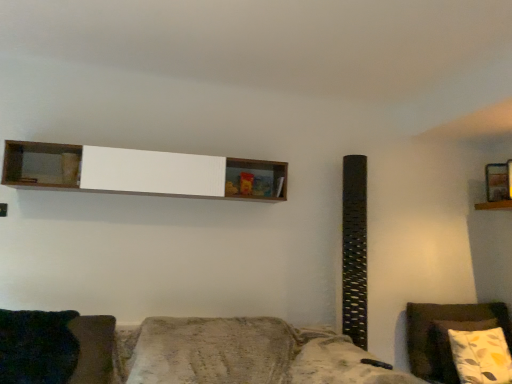
Question: Considering the relative sizes of white wood shelf at upper center, which is the 1th shelf in front-to-back order, and dark green fabric pillow at lower left in the image provided, is white wood shelf at upper center, which is the 1th shelf in front-to-back order, wider than dark green fabric pillow at lower left?

Choices:
 (A) no
 (B) yes

Answer: (A)

Question: Is dark green fabric pillow at lower left surrounded by white wood shelf at upper center, the 2th shelf in the back-to-front sequence?

Choices:
 (A) no
 (B) yes

Answer: (A)

Question: Is white wood shelf at upper center, which ranks as the 1th shelf in left-to-right order, thinner than dark green fabric pillow at lower left?

Choices:
 (A) no
 (B) yes

Answer: (B)

Question: From the image's perspective, would you say white wood shelf at upper center, which ranks as the 1th shelf in left-to-right order, is positioned over dark green fabric pillow at lower left?

Choices:
 (A) yes
 (B) no

Answer: (A)

Question: Is white wood shelf at upper center, which ranks as the 1th shelf in left-to-right order, at the left side of dark green fabric pillow at lower left?

Choices:
 (A) no
 (B) yes

Answer: (A)

Question: From a real-world perspective, is white wood shelf at upper center, which ranks as the 1th shelf in left-to-right order, positioned under dark green fabric pillow at lower left based on gravity?

Choices:
 (A) no
 (B) yes

Answer: (A)

Question: Can you confirm if wooden shelf at upper right, acting as the 1th shelf starting from the right, is smaller than floral pillow at right?

Choices:
 (A) no
 (B) yes

Answer: (B)

Question: Considering the relative positions of wooden shelf at upper right, marked as the 1th shelf in a back-to-front arrangement, and floral pillow at right in the image provided, is wooden shelf at upper right, marked as the 1th shelf in a back-to-front arrangement, to the left of floral pillow at right from the viewer's perspective?

Choices:
 (A) yes
 (B) no

Answer: (B)

Question: Can you confirm if wooden shelf at upper right, which is counted as the 2th shelf, starting from the front, is bigger than floral pillow at right?

Choices:
 (A) no
 (B) yes

Answer: (A)

Question: Would you say wooden shelf at upper right, the 2th shelf viewed from the left, contains floral pillow at right?

Choices:
 (A) yes
 (B) no

Answer: (B)

Question: From the image's perspective, would you say wooden shelf at upper right, which is counted as the 2th shelf, starting from the front, is shown under floral pillow at right?

Choices:
 (A) yes
 (B) no

Answer: (B)

Question: Is wooden shelf at upper right, acting as the 1th shelf starting from the right, completely or partially outside of floral pillow at right?

Choices:
 (A) no
 (B) yes

Answer: (B)

Question: Is dark green fabric pillow at lower left positioned in front of floral pillow at right?

Choices:
 (A) no
 (B) yes

Answer: (B)